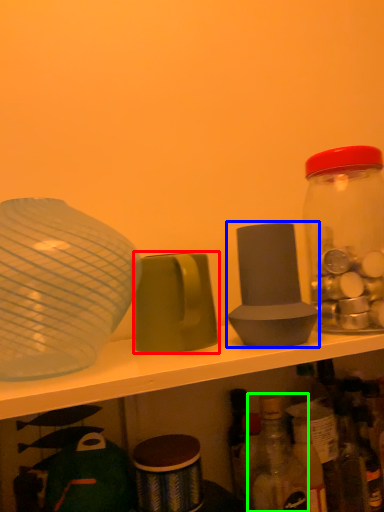
Question: Which object is the closest to the tableware (highlighted by a red box)? Choose among these: tableware (highlighted by a blue box) or bottle (highlighted by a green box).

Choices:
 (A) tableware
 (B) bottle

Answer: (A)